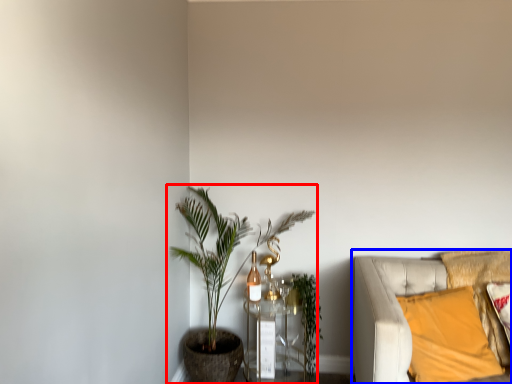
Question: Which of the following is the farthest to the observer, houseplant (highlighted by a red box) or studio couch (highlighted by a blue box)?

Choices:
 (A) houseplant
 (B) studio couch

Answer: (A)